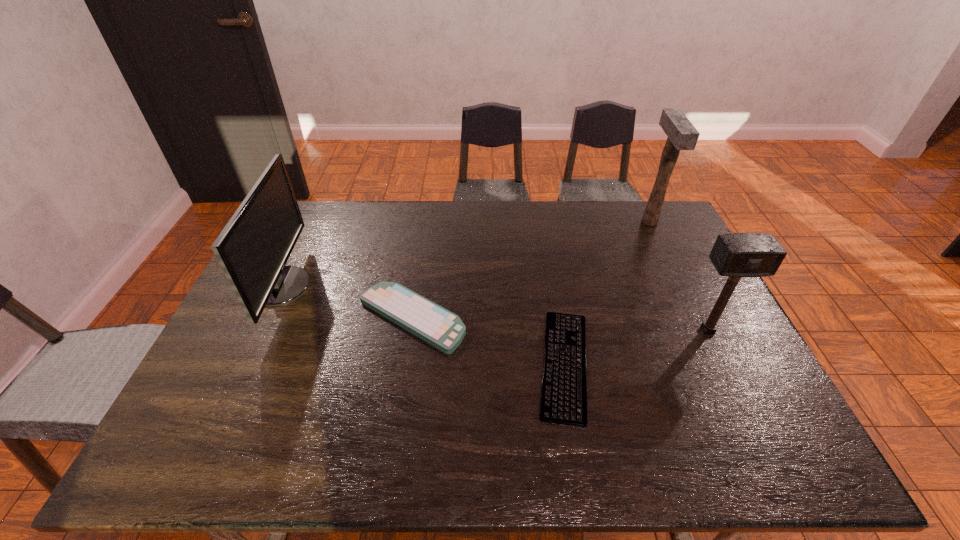
At what (x,y) coordinates should I click in order to perform the action: click on free space between the leftmost object and the left computer keyboard. Please return your answer as a coordinate pair (x, y). The image size is (960, 540). Looking at the image, I should click on (347, 302).

Identify the location of the closest object relative to the leftmost object. (439, 327).

Locate an element on the screen. object that is the closest to the left computer keyboard is located at coordinates (253, 248).

Locate an element on the screen. The width and height of the screenshot is (960, 540). vacant area that satisfies the following two spatial constraints: 1. on the back side of the taller computer keyboard; 2. on the right side of the farthest object is located at coordinates (426, 221).

At what (x,y) coordinates should I click in order to perform the action: click on vacant region that satisfies the following two spatial constraints: 1. on the screen side of the leftmost object; 2. on the left side of the left computer keyboard. Please return your answer as a coordinate pair (x, y). This screenshot has height=540, width=960. Looking at the image, I should click on (267, 318).

What are the coordinates of `free space in the image that satisfies the following two spatial constraints: 1. on the screen side of the monitor; 2. on the right side of the fourth tallest object` in the screenshot? It's located at (267, 318).

At what (x,y) coordinates should I click in order to perform the action: click on vacant region that satisfies the following two spatial constraints: 1. on the screen side of the leftmost object; 2. on the left side of the second object from left to right. Please return your answer as a coordinate pair (x, y). Looking at the image, I should click on (267, 318).

This screenshot has width=960, height=540. I want to click on vacant point that satisfies the following two spatial constraints: 1. on the screen side of the nearer mallet; 2. on the right side of the monitor, so click(x=261, y=330).

Find the location of a particular element. This screenshot has width=960, height=540. free space that satisfies the following two spatial constraints: 1. on the screen side of the shorter mallet; 2. on the left side of the leftmost object is located at coordinates (261, 330).

Locate an element on the screen. Image resolution: width=960 pixels, height=540 pixels. free space that satisfies the following two spatial constraints: 1. on the screen side of the monitor; 2. on the right side of the taller computer keyboard is located at coordinates tap(267, 318).